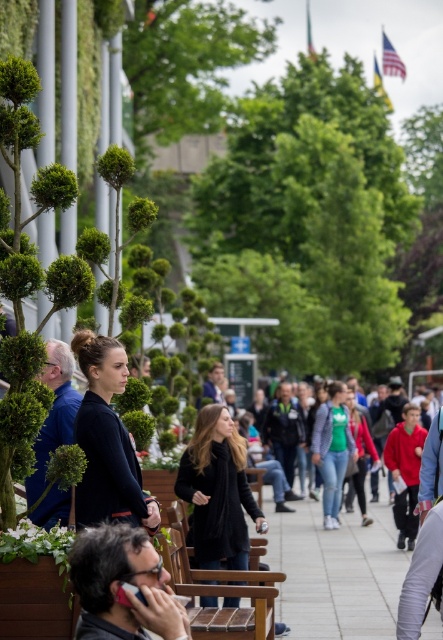
Between matte black phone at lower left and black matte jacket at center, which one appears on the right side from the viewer's perspective?

From the viewer's perspective, matte black phone at lower left appears more on the right side.

Between matte black phone at lower left and black matte jacket at center, which one has less height?

Standing shorter between the two is matte black phone at lower left.

Locate an element on the screen. Image resolution: width=443 pixels, height=640 pixels. matte black phone at lower left is located at coordinates (120, 586).

Is matte black jacket at left shorter than matte red hoodie at center-right?

Yes.

Which is more to the left, matte black jacket at left or matte red hoodie at center-right?

matte black jacket at left is more to the left.

Between point (54, 417) and point (396, 472), which one is positioned in front?

Positioned in front is point (54, 417).

At what (x,y) coordinates should I click in order to perform the action: click on matte black jacket at left. Please return your answer as a coordinate pair (x, y). Looking at the image, I should click on (54, 413).

Which is in front, point (151, 525) or point (345, 464)?

Point (151, 525) is more forward.

Locate an element on the screen. black matte jacket at center is located at coordinates (107, 442).

You are a GUI agent. You are given a task and a screenshot of the screen. Output one action in this format:
    pyautogui.click(x=<x>, y=<y>)
    Task: Click on the black matte jacket at center
    
    Given the screenshot: What is the action you would take?
    pyautogui.click(x=107, y=442)